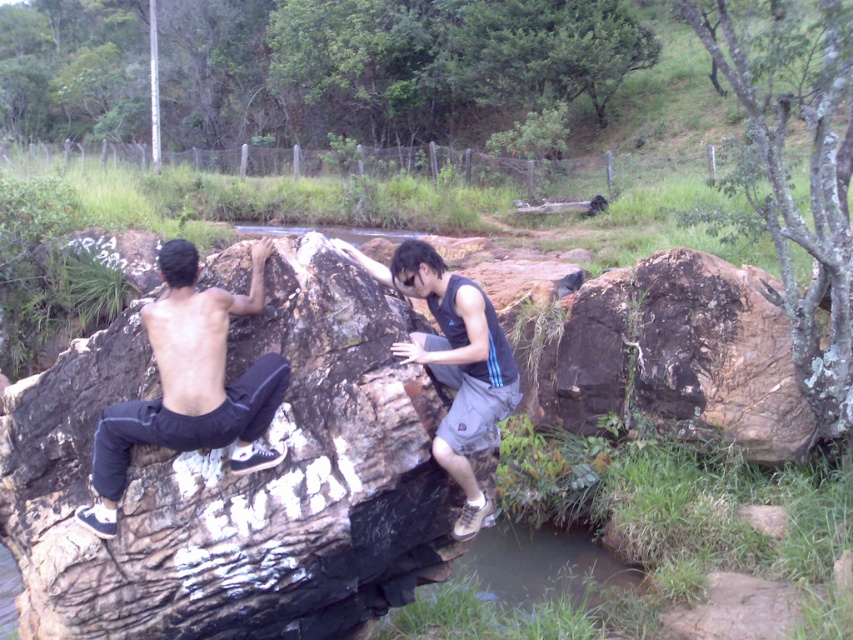
Consider the image. You are a photographer trying to capture both the rough textured rock at center and the dark blue sleeveless shirt at center in a single frame. Based on their sizes, which object should you focus on to ensure both fit in the photo?

The rough textured rock at center is wider than the dark blue sleeveless shirt at center, so focusing on the rock will ensure both objects fit in the frame since it occupies more space.

Consider the image. You are standing at the point marked as point (775, 401) and want to reach the fence in the background. The distance between you and the fence is 10 meters. Can you safely walk straight to the fence without encountering any obstacles?

The distance between point (775, 401) and the viewer is 6.17 meters. Since the total distance to the fence is 10 meters, subtracting the 6.17 meters gives a remaining distance of 3.83 meters between the point and the fence. Assuming no obstacles exist in this remaining path, you can safely walk straight to the fence.

You are a photographer standing at the base of the rock formation. You want to take a photo that includes both the point at the top of the rock formation marked as point (77, 374) and the lower point marked as point (415, 358). Which point should you focus on first to ensure both are in the frame?

You should focus on point (77, 374) first because it is closer to you than point (415, 358), so adjusting the camera to include both points will require framing from the closer point outward.